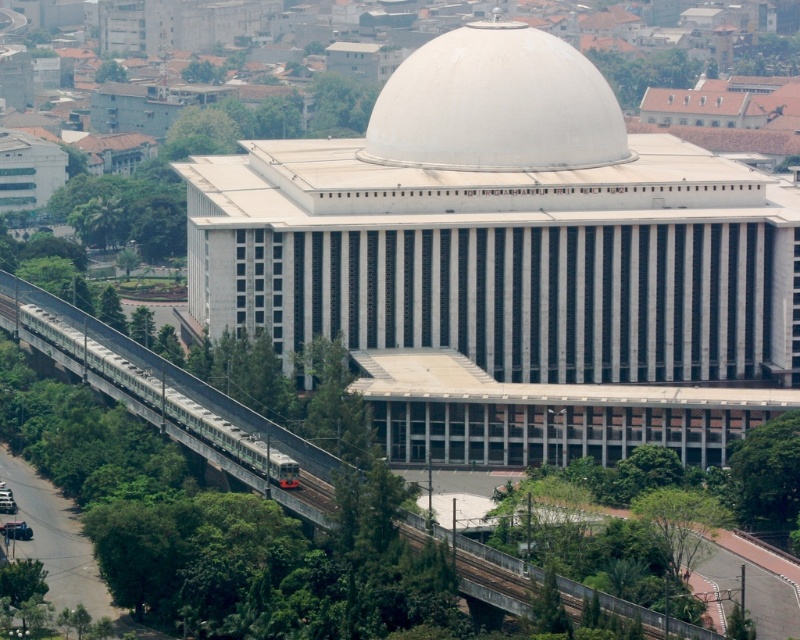
You are standing on the ground in front of the building and looking at the white smooth dome at center and the metallic gray train track at center. Which object is closer to you?

The metallic gray train track at center is behind the white smooth dome at center, so the white smooth dome at center is closer to you.

You are standing at the base of the building and want to take a photo of the white smooth dome at center. The camera you have can focus on objects up to 400 meters away. Will the dome be in focus?

The white smooth dome at center is 390.42 meters from viewer, which is within the camera focus range of 400 meters. Therefore, the dome will be in focus.

You are standing at the base of the building and want to take a photo of the white smooth dome at center. If you move 0.1 units to the right and 0.05 units forward, will the dome still be in your frame?

The white smooth dome at center is positioned at point (496,106). Moving 0.1 units right and 0.05 units forward would adjust your position, but since the dome is centrally located and the movement is relatively minor, it should remain within the frame.